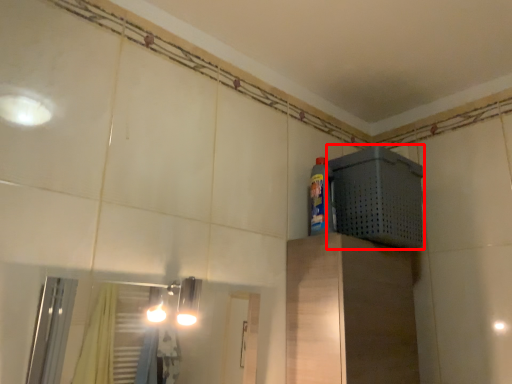
Question: In this image, where is appliance (annotated by the red box) located relative to bottle?

Choices:
 (A) left
 (B) right

Answer: (B)